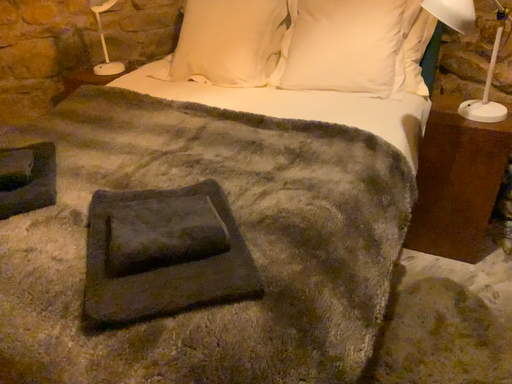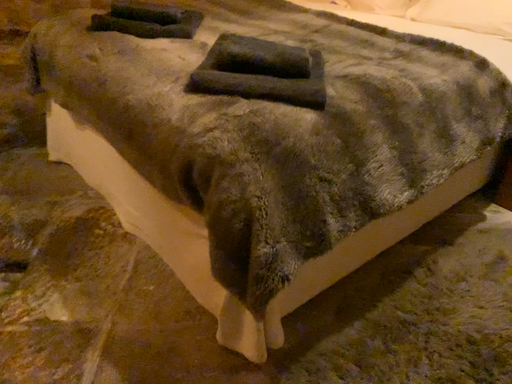
Question: How did the camera likely rotate when shooting the video?

Choices:
 (A) rotated left
 (B) rotated right

Answer: (A)